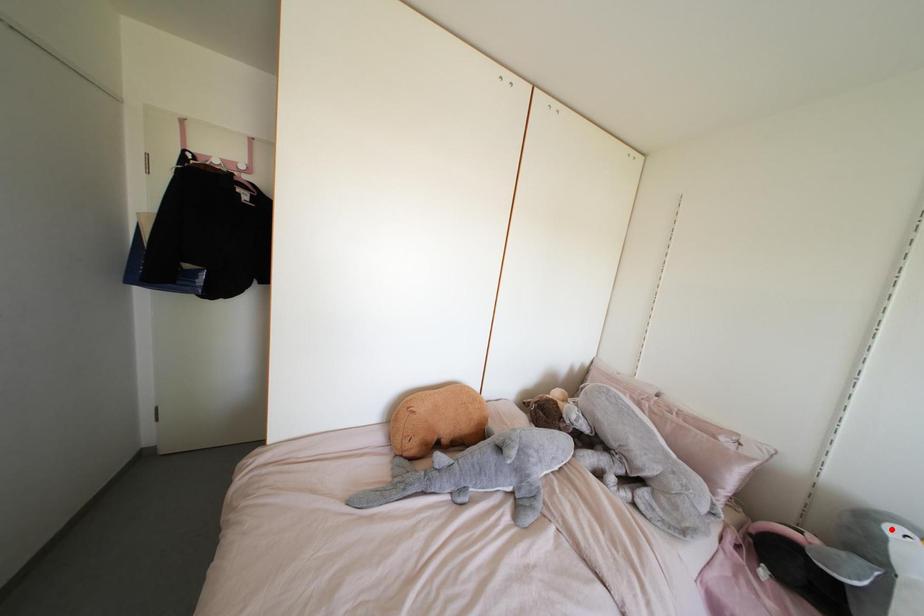
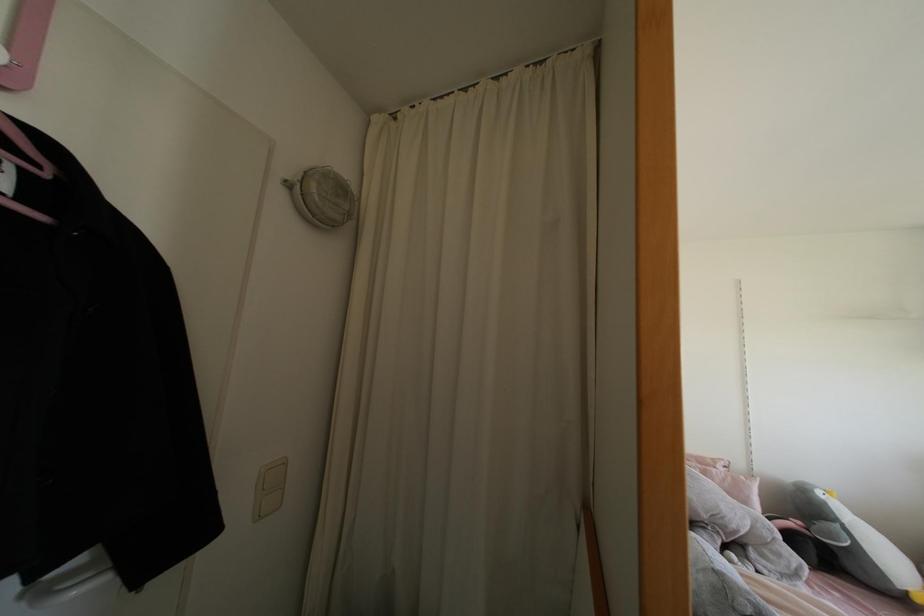
In the second image, find the point that corresponds to the highlighted location in the first image.

(819, 493)